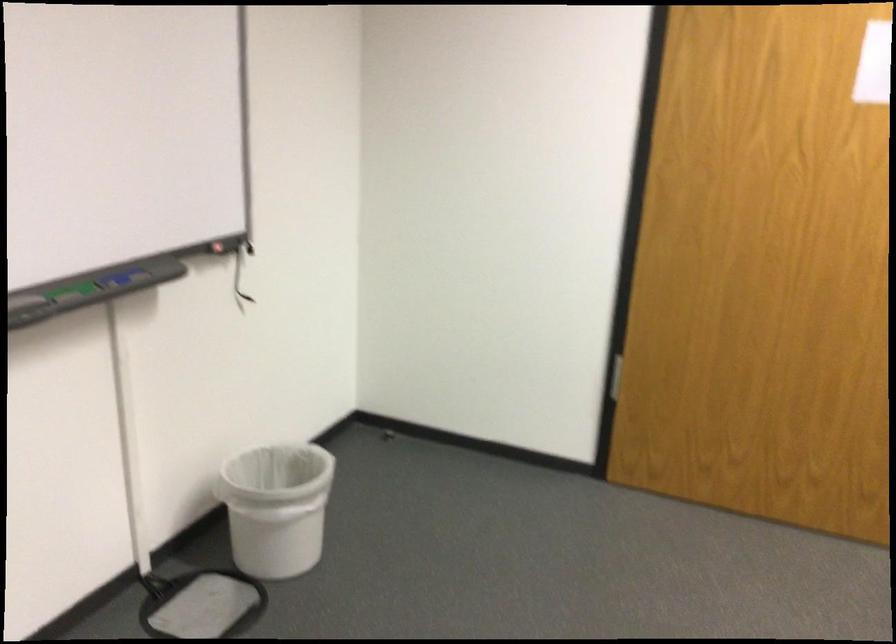
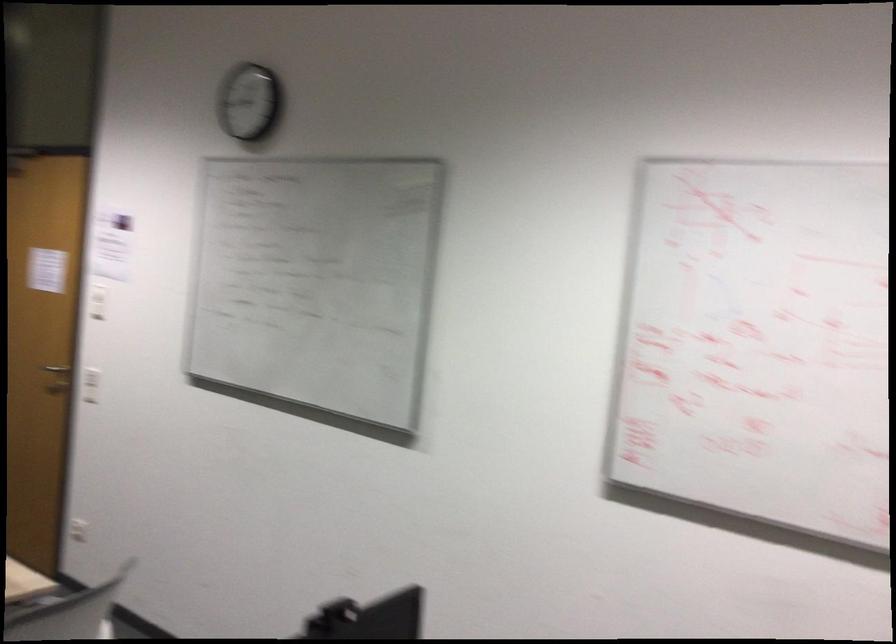
Find the pixel in the second image that matches the point at 825,237 in the first image.

(56, 368)